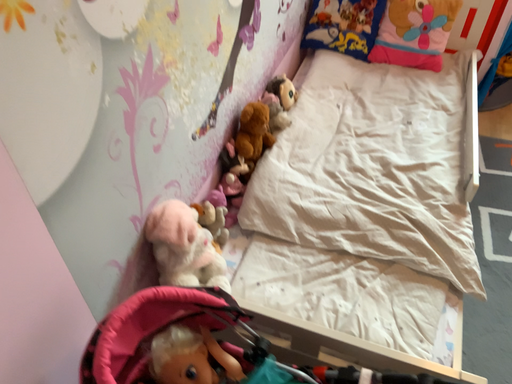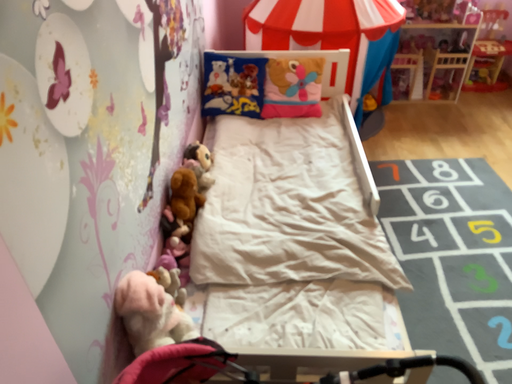
Question: How did the camera likely rotate when shooting the video?

Choices:
 (A) rotated left
 (B) rotated right

Answer: (B)